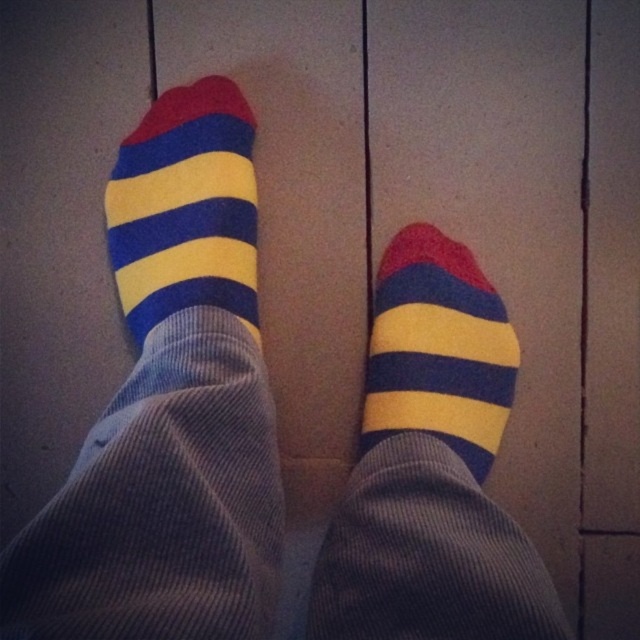
Does yellow-blue striped sock at center appear on the left side of matte striped sock at center?

Correct, you'll find yellow-blue striped sock at center to the left of matte striped sock at center.

Is point (166, 250) positioned behind point (417, 296)?

No, it is in front of (417, 296).

Between point (252, 244) and point (460, 417), which one is positioned in front?

Point (460, 417) is more forward.

At what (x,y) coordinates should I click in order to perform the action: click on yellow-blue striped sock at center. Please return your answer as a coordinate pair (x, y). Image resolution: width=640 pixels, height=640 pixels. Looking at the image, I should click on (186, 208).